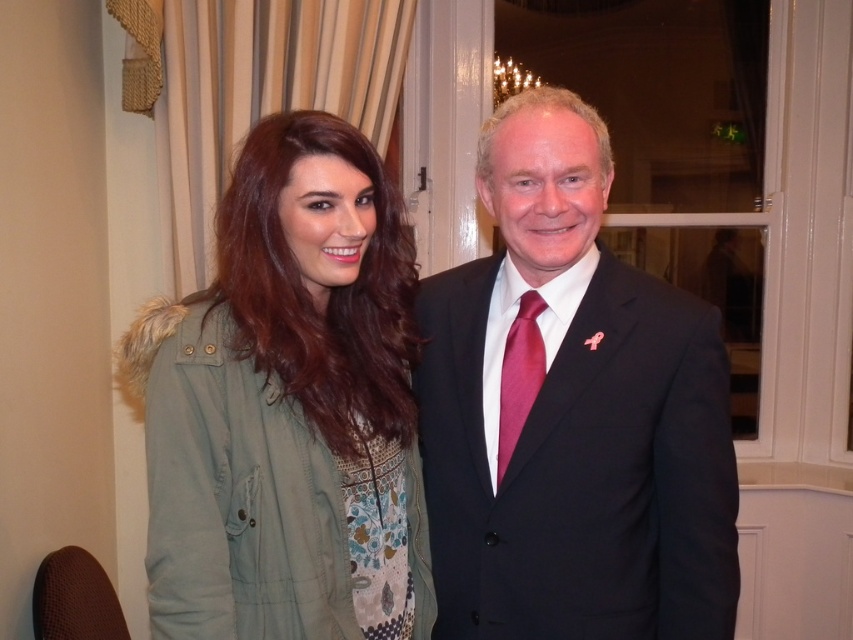
Looking at this image, does green fabric jacket at left appear on the right side of shiny magenta tie at center?

No, green fabric jacket at left is not to the right of shiny magenta tie at center.

Can you confirm if green fabric jacket at left is wider than shiny magenta tie at center?

Yes, green fabric jacket at left is wider than shiny magenta tie at center.

The height and width of the screenshot is (640, 853). Describe the element at coordinates (288, 406) in the screenshot. I see `green fabric jacket at left` at that location.

You are a GUI agent. You are given a task and a screenshot of the screen. Output one action in this format:
    pyautogui.click(x=<x>, y=<y>)
    Task: Click on the green fabric jacket at left
    The height and width of the screenshot is (640, 853).
    Given the screenshot: What is the action you would take?
    pyautogui.click(x=288, y=406)

Does point (424, 488) lie in front of point (524, 340)?

No, (424, 488) is behind (524, 340).

Does point (676, 461) come behind point (502, 401)?

No.

Where is `black suit at center`? Image resolution: width=853 pixels, height=640 pixels. black suit at center is located at coordinates (572, 413).

Between black suit at center and green fabric jacket at left, which one appears on the right side from the viewer's perspective?

Positioned to the right is black suit at center.

Does black suit at center appear on the left side of green fabric jacket at left?

In fact, black suit at center is to the right of green fabric jacket at left.

Image resolution: width=853 pixels, height=640 pixels. What do you see at coordinates (572, 413) in the screenshot?
I see `black suit at center` at bounding box center [572, 413].

Locate an element on the screen. The image size is (853, 640). black suit at center is located at coordinates (572, 413).